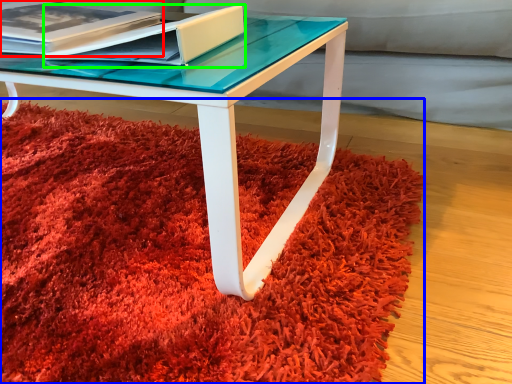
Question: Considering the real-world distances, which object is closest to paperback book (highlighted by a red box)? mat (highlighted by a blue box) or paperback book (highlighted by a green box).

Choices:
 (A) mat
 (B) paperback book

Answer: (B)